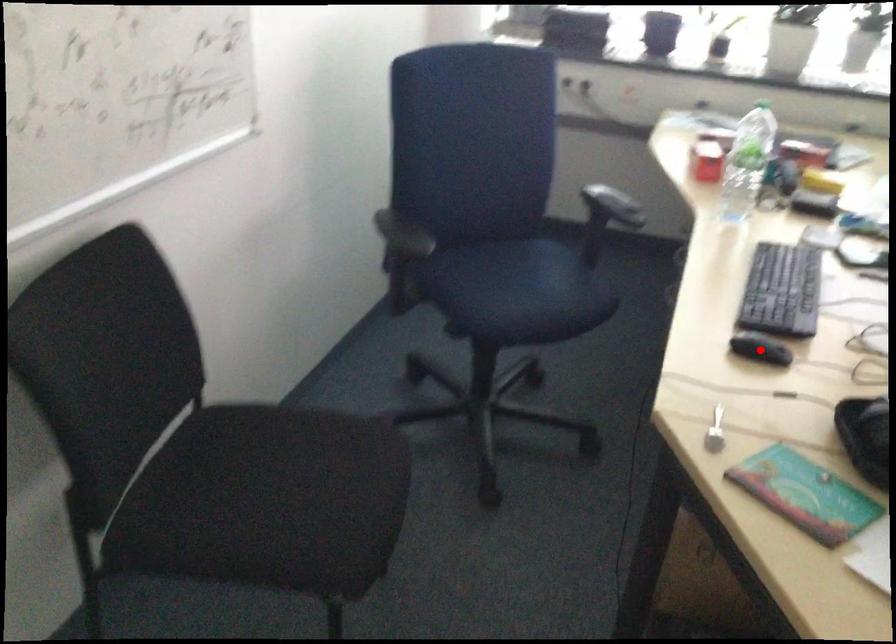
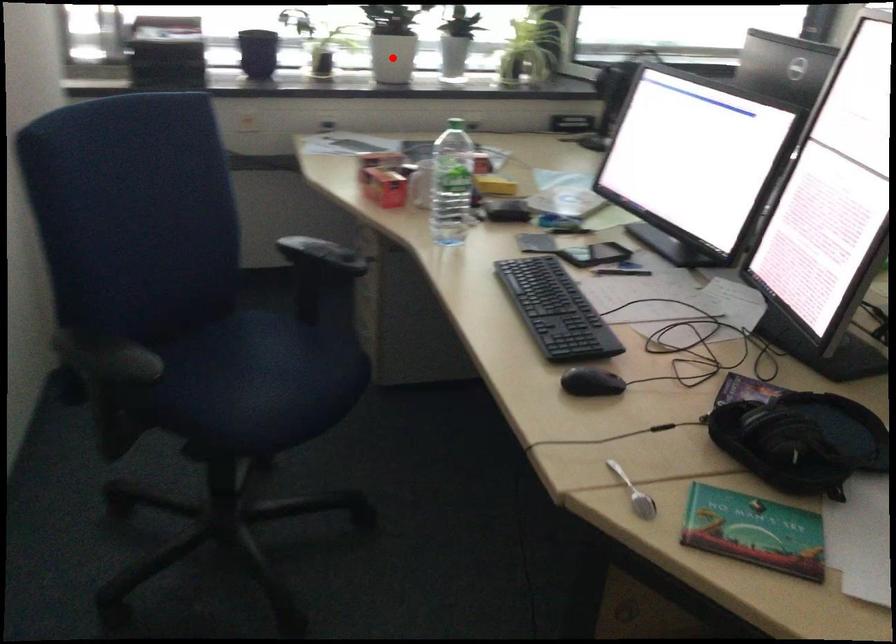
I am providing you with two images of the same scene from different viewpoints. A red point is marked on the first image and another point is marked on the second image. Do the highlighted points in image1 and image2 indicate the same real-world spot?

No